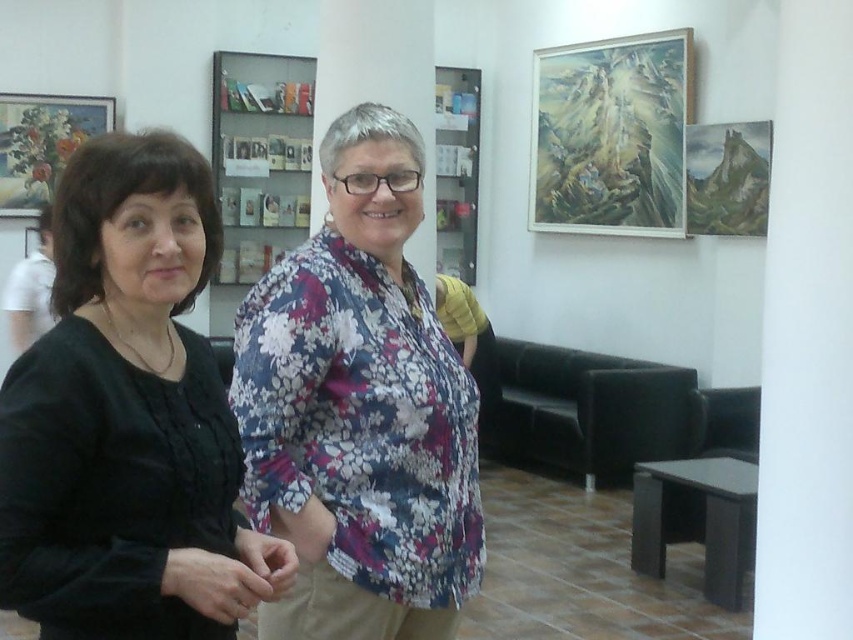
Who is shorter, floral fabric blouse at center or oil painting at upper right?

floral fabric blouse at center

Locate an element on the screen. The image size is (853, 640). floral fabric blouse at center is located at coordinates (358, 410).

Consider the image. Is black matte shirt at left bigger than matte wooden picture frame at upper right?

Actually, black matte shirt at left might be smaller than matte wooden picture frame at upper right.

Does black matte shirt at left have a smaller size compared to matte wooden picture frame at upper right?

Yes.

Who is more forward, (170, 148) or (722, 195)?

Point (170, 148) is more forward.

This screenshot has width=853, height=640. I want to click on black matte shirt at left, so click(126, 417).

Does floral fabric blouse at center have a larger size compared to white shirt at left?

No.

Is point (349, 570) positioned behind point (50, 224)?

No.

The width and height of the screenshot is (853, 640). I want to click on floral fabric blouse at center, so click(x=358, y=410).